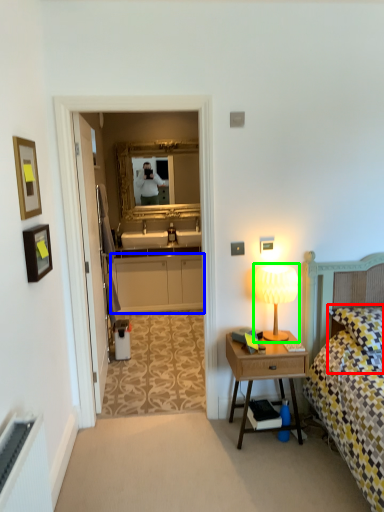
Question: Based on their relative distances, which object is farther from pillow (highlighted by a red box)? Choose from cabinetry (highlighted by a blue box) and table lamp (highlighted by a green box).

Choices:
 (A) cabinetry
 (B) table lamp

Answer: (A)